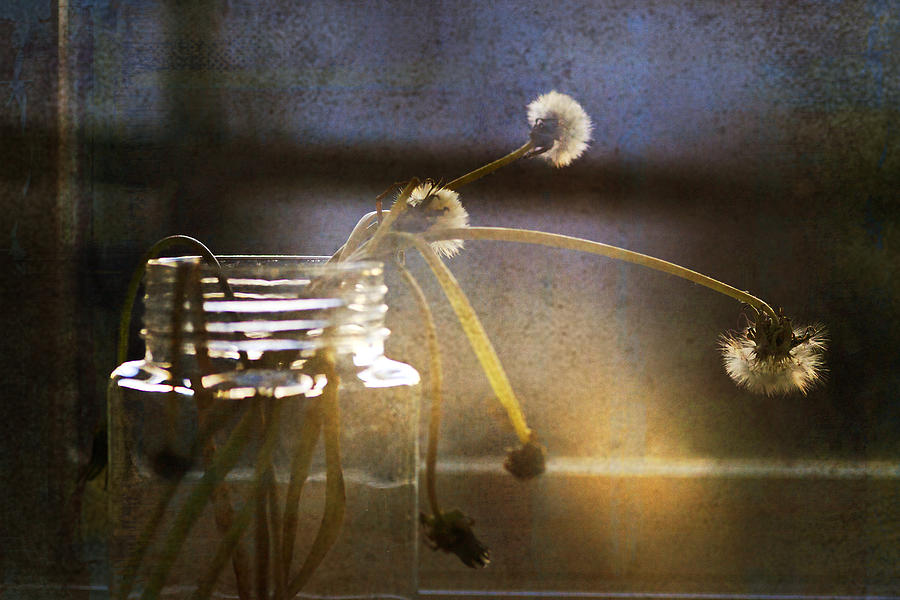
Identify the location of wall. (713, 160).